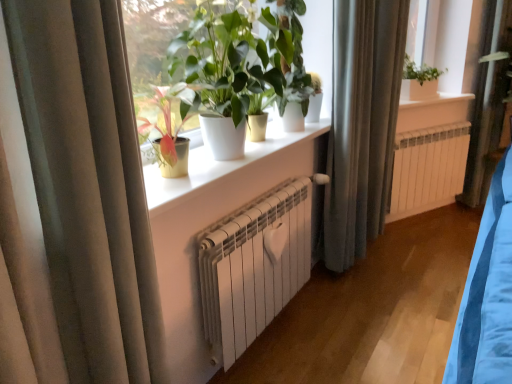
This screenshot has height=384, width=512. What do you see at coordinates (224, 75) in the screenshot?
I see `white glossy pot at center, the second houseplant viewed from the back` at bounding box center [224, 75].

Identify the location of white ceramic window sill at upper center, the first window sill positioned from the top. (433, 100).

Find the location of a particular element. This screenshot has width=512, height=384. white metallic radiator at center is located at coordinates (428, 169).

This screenshot has height=384, width=512. What do you see at coordinates (428, 169) in the screenshot? I see `white metallic radiator at center` at bounding box center [428, 169].

Measure the distance between point (x=129, y=146) and camera.

They are 37.64 inches apart.

What is the approximate height of white glossy window sill at center, which is the 1th window sill from left to right?

The height of white glossy window sill at center, which is the 1th window sill from left to right, is 4.23 centimeters.

Describe the element at coordinates (292, 65) in the screenshot. I see `green glossy plant at center, which is counted as the second houseplant, starting from the front` at that location.

In order to face white matte radiator at center, should I rotate leftwards or rightwards?

To align with it, rotate right about 2.512°.

The image size is (512, 384). Identify the location of white glossy pot at center, the 1th houseplant positioned from the front. (224, 75).

Is white metallic radiator at center next to white matte radiator at center and touching it?

white metallic radiator at center and white matte radiator at center are not in contact.

From the image's perspective, between white metallic radiator at center and white matte radiator at center, who is located below?

white matte radiator at center.

The width and height of the screenshot is (512, 384). I want to click on radiator in front of the white metallic radiator at center, so pos(254,265).

Is point (71, 208) closer or farther from the camera than point (275, 76)?

Clearly, point (71, 208) is closer to the camera than point (275, 76).

From the image's perspective, is beige fabric curtain at left, marked as the second curtain in a back-to-front arrangement, over white glossy pot at center, the 1th houseplant positioned from the front?

No, from the image's perspective, beige fabric curtain at left, marked as the second curtain in a back-to-front arrangement, is not above white glossy pot at center, the 1th houseplant positioned from the front.

Can you confirm if beige fabric curtain at left, marked as the second curtain in a back-to-front arrangement, is smaller than white glossy pot at center, the 1th houseplant positioned from the front?

Indeed, beige fabric curtain at left, marked as the second curtain in a back-to-front arrangement, has a smaller size compared to white glossy pot at center, the 1th houseplant positioned from the front.

Based on the photo, is beige fabric curtain at left, placed as the 1th curtain when sorted from front to back, touching white glossy pot at center, the 1th houseplant positioned from the front?

No, beige fabric curtain at left, placed as the 1th curtain when sorted from front to back, is not in contact with white glossy pot at center, the 1th houseplant positioned from the front.

In terms of size, does silky gray curtain at center, which is the second curtain in front-to-back order, appear bigger or smaller than white ceramic window sill at upper center, which is the second window sill from bottom to top?

In the image, silky gray curtain at center, which is the second curtain in front-to-back order, appears to be larger than white ceramic window sill at upper center, which is the second window sill from bottom to top.

Does silky gray curtain at center, which is the second curtain from left to right, have a greater width compared to white ceramic window sill at upper center, the first window sill from the back?

No.

Based on the photo, choose the correct answer: Is silky gray curtain at center, the first curtain in the right-to-left sequence, inside white ceramic window sill at upper center, which is the second window sill from bottom to top, or outside it?

silky gray curtain at center, the first curtain in the right-to-left sequence, exists outside the volume of white ceramic window sill at upper center, which is the second window sill from bottom to top.

From the picture: Would you say white glossy pot at center, the second houseplant viewed from the back, is a long distance from white ceramic window sill at upper center, the first window sill positioned from the top?

white glossy pot at center, the second houseplant viewed from the back, is far away from white ceramic window sill at upper center, the first window sill positioned from the top.

Which is more to the left, white glossy pot at center, the 1th houseplant positioned from the front, or white ceramic window sill at upper center, the first window sill positioned from the top?

Positioned to the left is white glossy pot at center, the 1th houseplant positioned from the front.

Is white ceramic window sill at upper center, which is the second window sill from bottom to top, located within white glossy pot at center, the 1th houseplant positioned from the front?

No, white ceramic window sill at upper center, which is the second window sill from bottom to top, is not a part of white glossy pot at center, the 1th houseplant positioned from the front.

From the image's perspective, who appears lower, white glossy pot at center, the second houseplant viewed from the back, or white ceramic window sill at upper center, the first window sill positioned from the top?

white glossy pot at center, the second houseplant viewed from the back, is shown below in the image.

In the scene shown: From a real-world perspective, which is physically above, white ceramic window sill at upper center, the first window sill positioned from the top, or silky gray curtain at center, the 1th curtain positioned from the back?

white ceramic window sill at upper center, the first window sill positioned from the top.

Is white ceramic window sill at upper center, the first window sill positioned from the top, aimed at silky gray curtain at center, the 1th curtain positioned from the back?

No, white ceramic window sill at upper center, the first window sill positioned from the top, does not turn towards silky gray curtain at center, the 1th curtain positioned from the back.

Is white ceramic window sill at upper center, the second window sill from the left, not within silky gray curtain at center, which is the second curtain from left to right?

That's correct, white ceramic window sill at upper center, the second window sill from the left, is outside of silky gray curtain at center, which is the second curtain from left to right.

In the scene shown: Which object is closer to the camera taking this photo, white glossy window sill at center, the second window sill from the back, or white matte radiator at center?

white glossy window sill at center, the second window sill from the back, is more forward.

Which of these two, white glossy window sill at center, the second window sill from the back, or white matte radiator at center, is bigger?

white matte radiator at center.

From the picture: Is white glossy window sill at center, which is the first window sill in bottom-to-top order, aimed at white matte radiator at center?

No, white glossy window sill at center, which is the first window sill in bottom-to-top order, is not facing towards white matte radiator at center.

Considering the sizes of objects white glossy window sill at center, which is the first window sill in bottom-to-top order, and white matte radiator at center in the image provided, who is wider, white glossy window sill at center, which is the first window sill in bottom-to-top order, or white matte radiator at center?

white glossy window sill at center, which is the first window sill in bottom-to-top order, is wider.

Consider the image. Can you confirm if white glossy pot at center, the 1th houseplant positioned from the front, is shorter than white metallic radiator at center?

In fact, white glossy pot at center, the 1th houseplant positioned from the front, may be taller than white metallic radiator at center.

From the image's perspective, which one is positioned higher, white glossy pot at center, the second houseplant viewed from the back, or white metallic radiator at center?

white glossy pot at center, the second houseplant viewed from the back, is shown above in the image.

From a real-world perspective, between white glossy pot at center, the second houseplant viewed from the back, and white metallic radiator at center, who is vertically lower?

white metallic radiator at center is physically lower.

The height and width of the screenshot is (384, 512). I want to click on air conditioning behind the white matte radiator at center, so click(x=428, y=169).

You are a GUI agent. You are given a task and a screenshot of the screen. Output one action in this format:
    pyautogui.click(x=<x>, y=<y>)
    Task: Click on the 2nd curtain below the white glossy pot at center, the 1th houseplant positioned from the front (from the image's perspective)
    This screenshot has height=384, width=512.
    Given the screenshot: What is the action you would take?
    pyautogui.click(x=89, y=186)

Estimate the real-world distances between objects in this image. Which object is closer to white glossy pot at center, the second houseplant viewed from the back, white glossy window sill at center, the 2th window sill viewed from the right, or silky gray curtain at center, the 1th curtain positioned from the back?

Among the two, white glossy window sill at center, the 2th window sill viewed from the right, is located nearer to white glossy pot at center, the second houseplant viewed from the back.

From the image, which object appears to be nearer to green glossy plant at center, which is the 1th houseplant from back to front, beige fabric curtain at left, marked as the 2th curtain in a right-to-left arrangement, or white metallic radiator at center?

beige fabric curtain at left, marked as the 2th curtain in a right-to-left arrangement.

When comparing their distances from silky gray curtain at center, the 1th curtain positioned from the back, does white matte radiator at center or white metallic radiator at center seem further?

Among the two, white matte radiator at center is located further to silky gray curtain at center, the 1th curtain positioned from the back.

Looking at the image, which one is located further to beige fabric curtain at left, placed as the 1th curtain when sorted from front to back, white glossy pot at center, the 1th houseplant positioned from the front, or white matte radiator at center?

white glossy pot at center, the 1th houseplant positioned from the front, lies further to beige fabric curtain at left, placed as the 1th curtain when sorted from front to back, than the other object.

From the image, which object appears to be farther from white glossy window sill at center, which is the 1th window sill from left to right, white metallic radiator at center or silky gray curtain at center, which is the second curtain from left to right?

white metallic radiator at center lies further to white glossy window sill at center, which is the 1th window sill from left to right, than the other object.

Which object lies nearer to the anchor point beige fabric curtain at left, placed as the 1th curtain when sorted from front to back, white glossy window sill at center, which is the 1th window sill from left to right, or white ceramic window sill at upper center, which is the second window sill from bottom to top?

The object closer to beige fabric curtain at left, placed as the 1th curtain when sorted from front to back, is white glossy window sill at center, which is the 1th window sill from left to right.

Considering their positions, is white ceramic window sill at upper center, the first window sill positioned from the top, positioned closer to green glossy plant at center, which is the 1th houseplant from back to front, than white glossy pot at center, the second houseplant viewed from the back?

white glossy pot at center, the second houseplant viewed from the back, is closer to green glossy plant at center, which is the 1th houseplant from back to front.

Which object lies further to the anchor point green glossy plant at center, which is the 1th houseplant from back to front, silky gray curtain at center, which is the second curtain in front-to-back order, or white glossy pot at center, the second houseplant viewed from the back?

silky gray curtain at center, which is the second curtain in front-to-back order, is further to green glossy plant at center, which is the 1th houseplant from back to front.

The image size is (512, 384). I want to click on curtain positioned between green glossy plant at center, which is the 1th houseplant from back to front, and white ceramic window sill at upper center, which is the second window sill from bottom to top, from near to far, so click(x=362, y=123).

The height and width of the screenshot is (384, 512). Identify the location of radiator positioned between beige fabric curtain at left, placed as the 1th curtain when sorted from front to back, and white metallic radiator at center from near to far. (254, 265).

Locate an element on the screen. curtain between white glossy window sill at center, which is the first window sill in front-to-back order, and white metallic radiator at center, along the z-axis is located at coordinates (362, 123).

You are a GUI agent. You are given a task and a screenshot of the screen. Output one action in this format:
    pyautogui.click(x=<x>, y=<y>)
    Task: Click on the houseplant between white matte radiator at center and white metallic radiator at center from front to back
    The width and height of the screenshot is (512, 384).
    Given the screenshot: What is the action you would take?
    pyautogui.click(x=292, y=65)